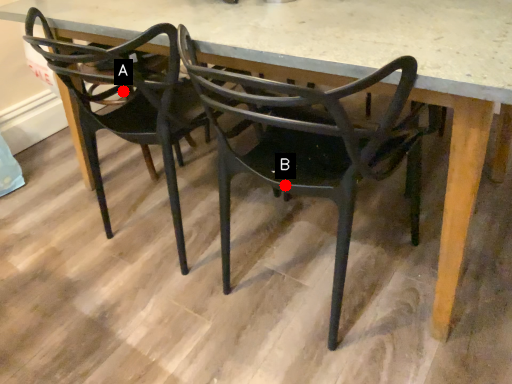
Question: Two points are circled on the image, labeled by A and B beside each circle. Among these points, which one is nearest to the camera?

Choices:
 (A) A is closer
 (B) B is closer

Answer: (B)